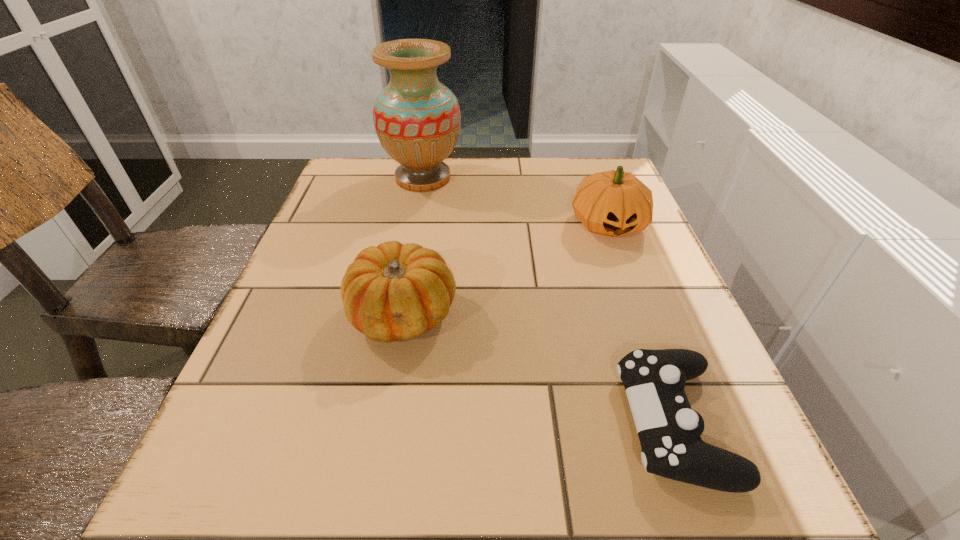
The image size is (960, 540). Identify the location of object that can be found as the closest to the control. tap(391, 292).

Find the location of a particular element. object identified as the second closest to the farthest object is located at coordinates (391, 292).

Locate an element on the screen. This screenshot has height=540, width=960. vacant space that satisfies the following two spatial constraints: 1. on the side of the farther gourd with the carved face; 2. on the surface of the control is located at coordinates (682, 422).

Where is `vacant space that satisfies the following two spatial constraints: 1. on the side of the farther gourd with the carved face; 2. on the surface of the control`? The width and height of the screenshot is (960, 540). vacant space that satisfies the following two spatial constraints: 1. on the side of the farther gourd with the carved face; 2. on the surface of the control is located at coordinates (682, 422).

I want to click on blank space that satisfies the following two spatial constraints: 1. on the front side of the nearer gourd; 2. on the right side of the farthest object, so click(397, 314).

At what (x,y) coordinates should I click in order to perform the action: click on blank area in the image that satisfies the following two spatial constraints: 1. on the side of the taller gourd with the carved face; 2. on the surface of the nearest object. Please return your answer as a coordinate pair (x, y). Image resolution: width=960 pixels, height=540 pixels. Looking at the image, I should click on (682, 422).

What are the coordinates of `blank space that satisfies the following two spatial constraints: 1. on the side of the farther gourd with the carved face; 2. on the surface of the control` in the screenshot? It's located at (682, 422).

I want to click on free space that satisfies the following two spatial constraints: 1. on the front side of the vase; 2. on the right side of the shorter gourd, so click(x=397, y=314).